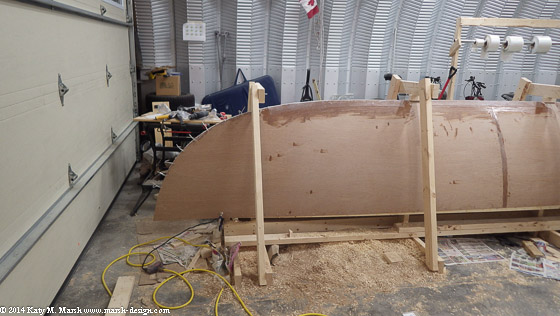
Where is `table`? The width and height of the screenshot is (560, 316). table is located at coordinates (150, 122).